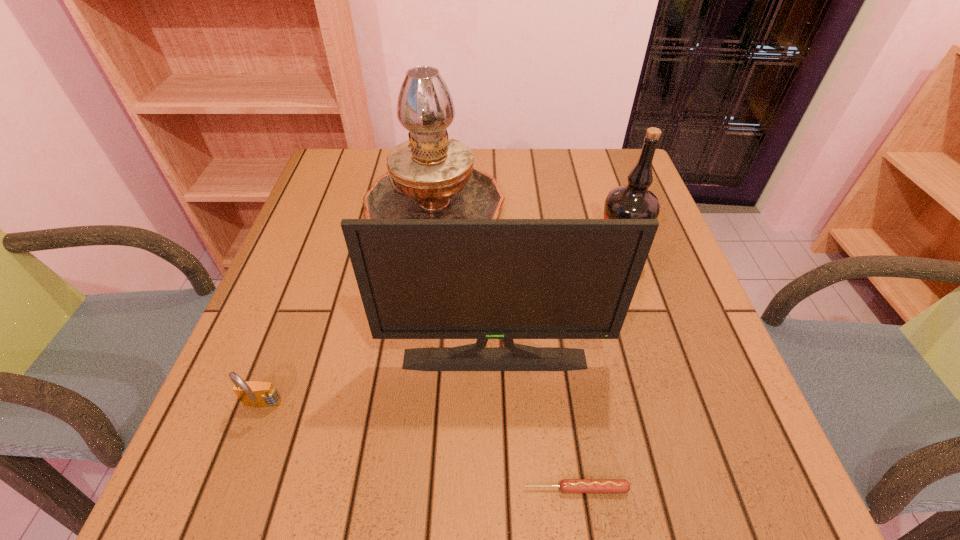
Image resolution: width=960 pixels, height=540 pixels. Find the location of `oil lamp`. oil lamp is located at coordinates (431, 176).

Where is `monitor`? The width and height of the screenshot is (960, 540). monitor is located at coordinates [482, 279].

The width and height of the screenshot is (960, 540). Find the location of `wine bottle`. wine bottle is located at coordinates (632, 201).

Identify the location of the fourth tallest object. This screenshot has width=960, height=540. [x=251, y=393].

Where is `padlock`? The image size is (960, 540). padlock is located at coordinates (251, 393).

In order to click on the nearest object in this screenshot , I will do `click(566, 485)`.

Locate an element on the screen. The width and height of the screenshot is (960, 540). sausage is located at coordinates (566, 485).

Find the location of a particular element. The height and width of the screenshot is (540, 960). vacant region located 0.320m on the front of the oil lamp is located at coordinates (413, 394).

Identify the location of vacant space situated 0.110m on the front-facing side of the monitor. This screenshot has height=540, width=960. (496, 430).

The height and width of the screenshot is (540, 960). Find the location of `blank space located on the back of the rightmost object`. blank space located on the back of the rightmost object is located at coordinates (596, 189).